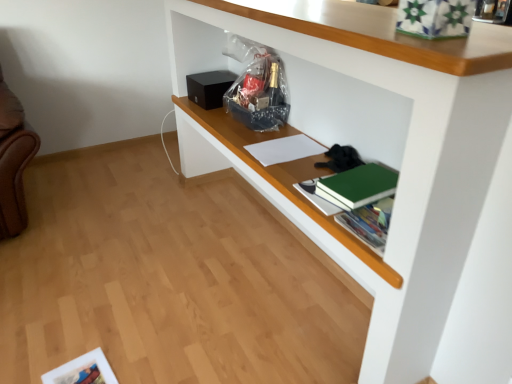
Question: Is white matte shelf at upper center aimed at green matte book at center-right?

Choices:
 (A) no
 (B) yes

Answer: (B)

Question: Is white matte shelf at upper center in front of green matte book at center-right?

Choices:
 (A) yes
 (B) no

Answer: (A)

Question: Is white matte shelf at upper center to the left of green matte book at center-right from the viewer's perspective?

Choices:
 (A) yes
 (B) no

Answer: (A)

Question: Does white matte shelf at upper center appear on the right side of green matte book at center-right?

Choices:
 (A) no
 (B) yes

Answer: (A)

Question: Is white matte shelf at upper center not near green matte book at center-right?

Choices:
 (A) no
 (B) yes

Answer: (A)

Question: From the image's perspective, is white matte shelf at upper center beneath green matte book at center-right?

Choices:
 (A) yes
 (B) no

Answer: (B)

Question: Is green matte book at center-right further to the viewer compared to white matte shelf at upper center?

Choices:
 (A) yes
 (B) no

Answer: (A)

Question: Is green matte book at center-right positioned far away from white matte shelf at upper center?

Choices:
 (A) no
 (B) yes

Answer: (A)

Question: Is green matte book at center-right smaller than white matte shelf at upper center?

Choices:
 (A) no
 (B) yes

Answer: (B)

Question: Is green matte book at center-right wider than white matte shelf at upper center?

Choices:
 (A) yes
 (B) no

Answer: (B)

Question: Is green matte book at center-right at the right side of white matte shelf at upper center?

Choices:
 (A) no
 (B) yes

Answer: (B)

Question: Considering the relative sizes of green matte book at center-right and white matte shelf at upper center in the image provided, is green matte book at center-right thinner than white matte shelf at upper center?

Choices:
 (A) yes
 (B) no

Answer: (A)

Question: Considering the relative positions of white paper at center and green matte book at center-right in the image provided, is white paper at center to the right of green matte book at center-right from the viewer's perspective?

Choices:
 (A) no
 (B) yes

Answer: (A)